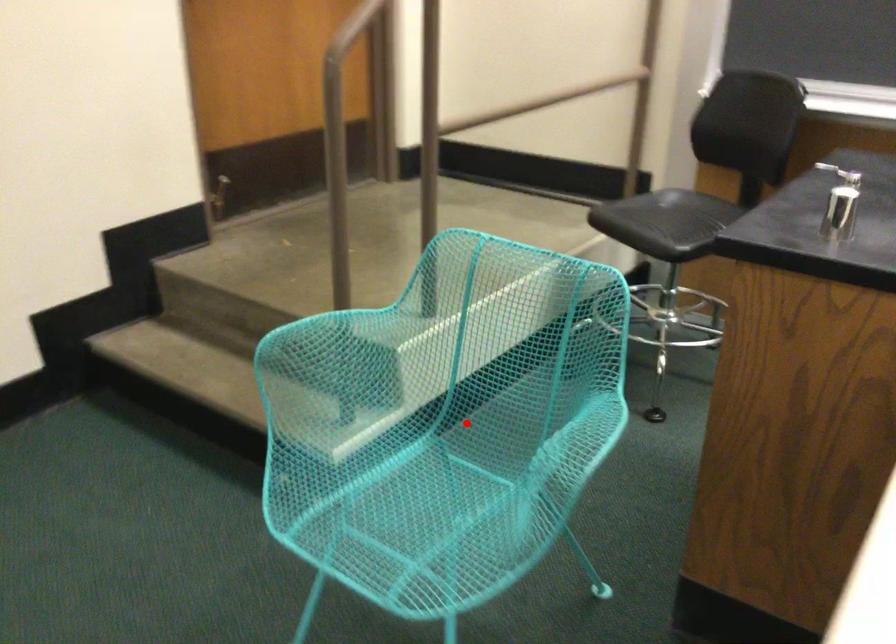
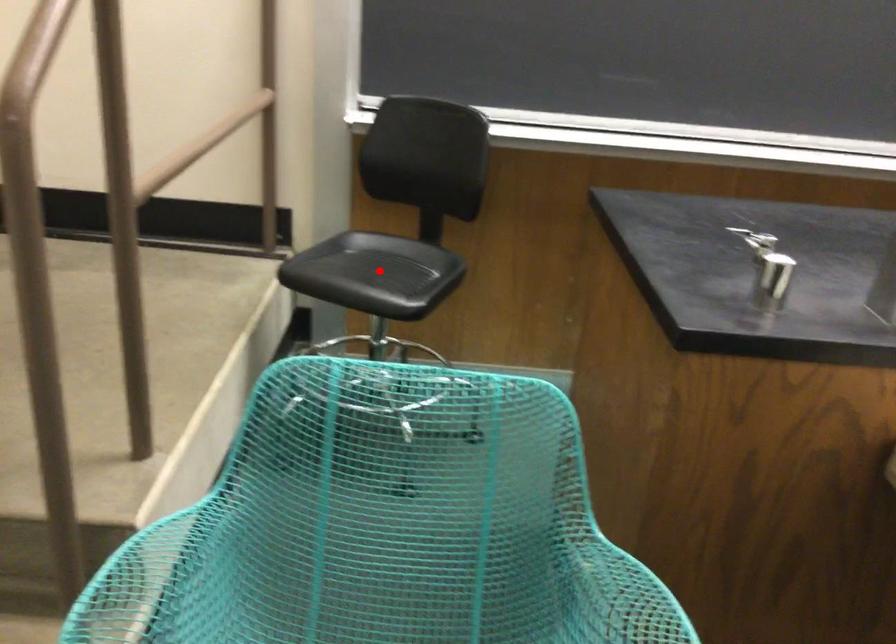
I am providing you with two images of the same scene from different viewpoints. A red point is marked on the first image and another point is marked on the second image. Is the red point in image1 aligned with the point shown in image2?

No